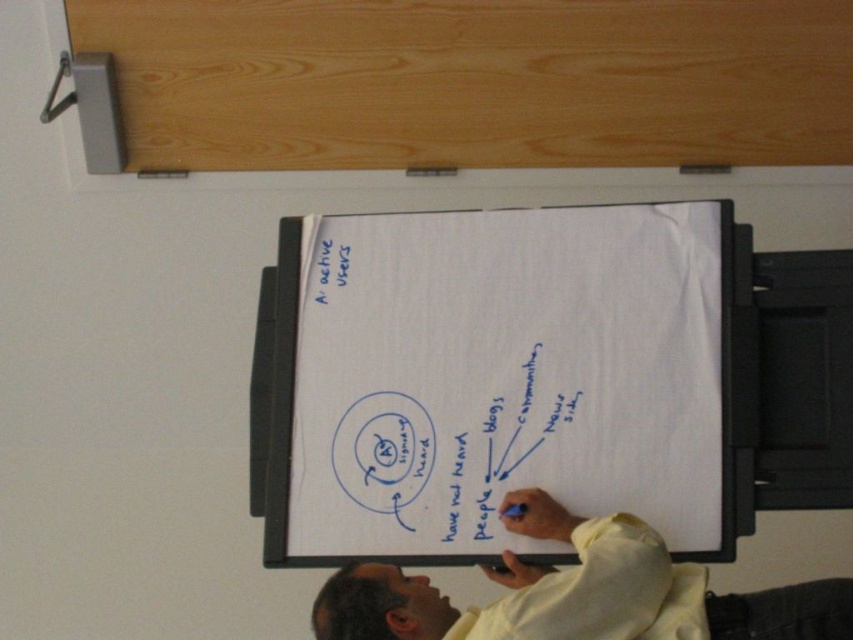
Who is more distant from viewer, (419, 516) or (492, 573)?

Point (419, 516)

Which is in front, point (392, 504) or point (608, 636)?

Point (608, 636) is more forward.

Find the location of a particular element. white paperboard at center is located at coordinates (496, 380).